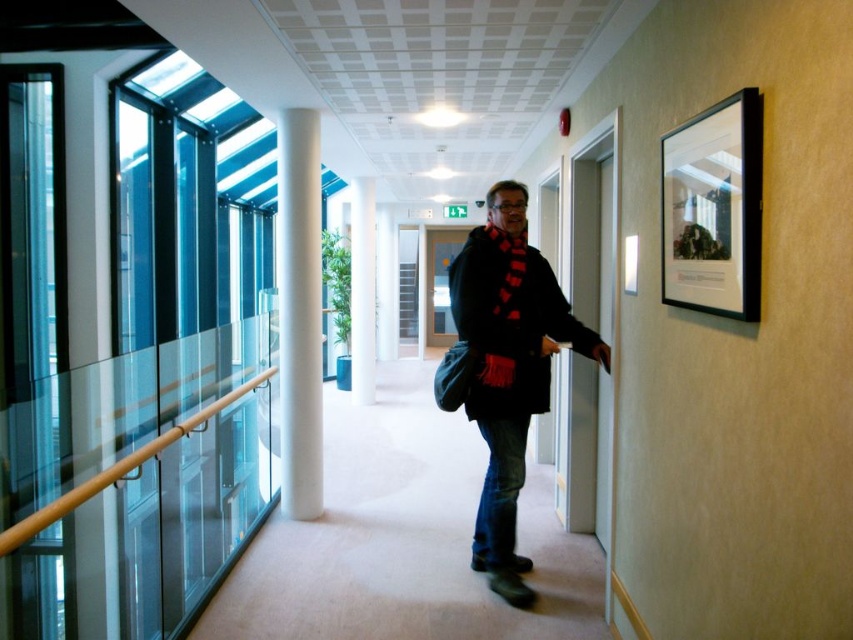
Is white smooth column at center positioned in front of white glossy pillar at center?

Yes, it is in front of white glossy pillar at center.

Is point (316, 140) less distant than point (354, 256)?

Yes, point (316, 140) is in front of point (354, 256).

Is point (280, 273) closer to camera compared to point (355, 300)?

Yes.

Image resolution: width=853 pixels, height=640 pixels. What are the coordinates of `white smooth column at center` in the screenshot? It's located at (299, 312).

Does black matte coat at center come behind white glossy pillar at center?

No, it is in front of white glossy pillar at center.

Who is positioned more to the left, black matte coat at center or white glossy pillar at center?

white glossy pillar at center

Which is behind, point (509, 595) or point (360, 246)?

The point (360, 246) is more distant.

At what (x,y) coordinates should I click in order to perform the action: click on black matte coat at center. Please return your answer as a coordinate pair (x, y). The width and height of the screenshot is (853, 640). Looking at the image, I should click on (505, 368).

Consider the image. Is black matte coat at center above white smooth column at center?

Actually, black matte coat at center is below white smooth column at center.

Is black matte coat at center smaller than white smooth column at center?

Actually, black matte coat at center might be larger than white smooth column at center.

Is point (488, 534) positioned behind point (312, 392)?

No, (488, 534) is in front of (312, 392).

I want to click on black matte coat at center, so click(x=505, y=368).